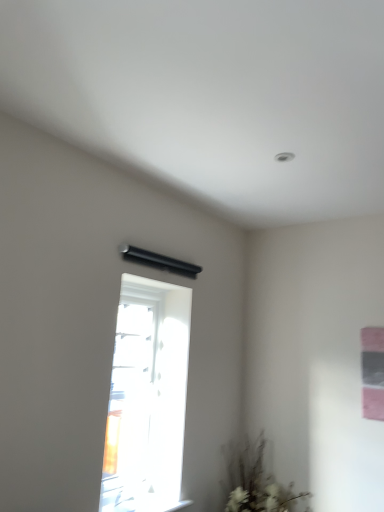
The height and width of the screenshot is (512, 384). What are the coordinates of `transparent glass window at center` in the screenshot? It's located at (147, 398).

The image size is (384, 512). What do you see at coordinates (147, 398) in the screenshot?
I see `transparent glass window at center` at bounding box center [147, 398].

Based on the photo, in order to face transparent glass window at center, should I rotate leftwards or rightwards?

You should rotate left by 7.782 degrees.

At what (x,y) coordinates should I click in order to perform the action: click on white matte plant at lower right. Please return your answer as a coordinate pair (x, y). Looking at the image, I should click on (254, 480).

What do you see at coordinates (254, 480) in the screenshot?
I see `white matte plant at lower right` at bounding box center [254, 480].

Where is `transparent glass window at center`? The height and width of the screenshot is (512, 384). transparent glass window at center is located at coordinates (147, 398).

Is white matte plant at lower right at the right side of transparent glass window at center?

Yes.

Is the position of white matte plant at lower right less distant than that of transparent glass window at center?

No, white matte plant at lower right is further to the viewer.

Does point (223, 446) come in front of point (131, 350)?

No.

From the image's perspective, which one is positioned higher, white matte plant at lower right or transparent glass window at center?

transparent glass window at center.

From a real-world perspective, is white matte plant at lower right over transparent glass window at center?

No.

From the picture: Is white matte plant at lower right wider or thinner than transparent glass window at center?

In the image, white matte plant at lower right appears to be wider than transparent glass window at center.

In terms of height, does white matte plant at lower right look taller or shorter compared to transparent glass window at center?

Clearly, white matte plant at lower right is shorter compared to transparent glass window at center.

From the picture: Between white matte plant at lower right and transparent glass window at center, which one has smaller size?

With smaller size is white matte plant at lower right.

Is transparent glass window at center a part of white matte plant at lower right?

Definitely not — transparent glass window at center is not inside white matte plant at lower right.

Are white matte plant at lower right and transparent glass window at center making contact?

No, white matte plant at lower right is not with transparent glass window at center.

Is white matte plant at lower right oriented towards transparent glass window at center?

No, white matte plant at lower right does not turn towards transparent glass window at center.

What's the angular difference between white matte plant at lower right and transparent glass window at center's facing directions?

90.2 degrees.

Locate an element on the screen. This screenshot has width=384, height=512. plant that appears below the transparent glass window at center (from the image's perspective) is located at coordinates 254,480.

Is transparent glass window at center at the left side of white matte plant at lower right?

Yes, transparent glass window at center is to the left of white matte plant at lower right.

Between transparent glass window at center and white matte plant at lower right, which one is positioned behind?

white matte plant at lower right is further from the camera.

Which is in front, point (106, 507) or point (232, 473)?

The point (106, 507) is in front.

From the image's perspective, would you say transparent glass window at center is shown under white matte plant at lower right?

Actually, transparent glass window at center appears above white matte plant at lower right in the image.

From a real-world perspective, does transparent glass window at center sit lower than white matte plant at lower right?

Actually, transparent glass window at center is physically above white matte plant at lower right in the real world.

Is transparent glass window at center thinner than white matte plant at lower right?

Yes.

Is transparent glass window at center taller or shorter than white matte plant at lower right?

Clearly, transparent glass window at center is taller compared to white matte plant at lower right.

Is transparent glass window at center bigger than white matte plant at lower right?

Correct, transparent glass window at center is larger in size than white matte plant at lower right.

Is transparent glass window at center completely or partially outside of white matte plant at lower right?

Indeed, transparent glass window at center is completely outside white matte plant at lower right.

Is transparent glass window at center positioned far away from white matte plant at lower right?

Actually, transparent glass window at center and white matte plant at lower right are a little close together.

Is transparent glass window at center facing away from white matte plant at lower right?

No, transparent glass window at center is not facing the opposite direction of white matte plant at lower right.

Can you tell me how much transparent glass window at center and white matte plant at lower right differ in facing direction?

transparent glass window at center and white matte plant at lower right are facing 90.2 degrees away from each other.

Measure the distance from transparent glass window at center to white matte plant at lower right.

transparent glass window at center is 25.21 inches away from white matte plant at lower right.

What are the coordinates of `window lying on the left of white matte plant at lower right` in the screenshot? It's located at (147, 398).

In the image, there is a transparent glass window at center. Where is `plant below it (from a real-world perspective)`? The height and width of the screenshot is (512, 384). plant below it (from a real-world perspective) is located at coordinates (254, 480).

The width and height of the screenshot is (384, 512). Identify the location of plant on the right of transparent glass window at center. (254, 480).